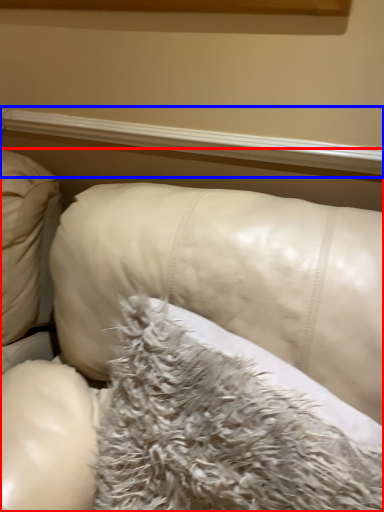
Question: Which of the following is the farthest to the observer, furniture (highlighted by a red box) or window sill (highlighted by a blue box)?

Choices:
 (A) furniture
 (B) window sill

Answer: (B)